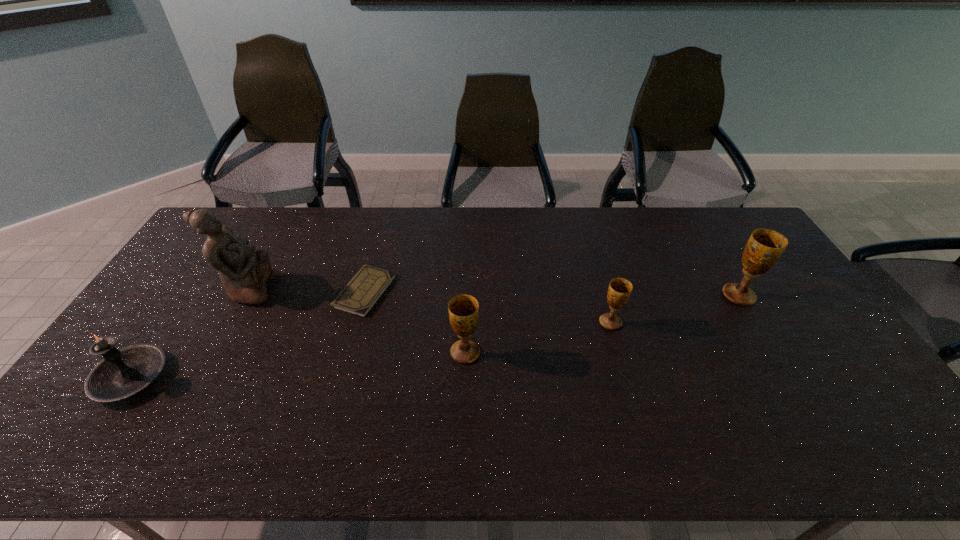
You are a GUI agent. You are given a task and a screenshot of the screen. Output one action in this format:
    pyautogui.click(x=<x>, y=<y>)
    Task: Click on the free space that satisfies the following two spatial constraints: 1. on the front-facing side of the tallest chalice; 2. on the left side of the tallest object
    The height and width of the screenshot is (540, 960).
    Given the screenshot: What is the action you would take?
    pyautogui.click(x=246, y=295)

Locate an element on the screen. free point that satisfies the following two spatial constraints: 1. on the front-facing side of the second object from left to right; 2. on the right side of the leftmost chalice is located at coordinates (214, 353).

Where is `vacant space that satisfies the following two spatial constraints: 1. on the front-facing side of the tallest object; 2. on the right side of the second chalice from right to left`? The height and width of the screenshot is (540, 960). vacant space that satisfies the following two spatial constraints: 1. on the front-facing side of the tallest object; 2. on the right side of the second chalice from right to left is located at coordinates (231, 322).

You are a GUI agent. You are given a task and a screenshot of the screen. Output one action in this format:
    pyautogui.click(x=<x>, y=<y>)
    Task: Click on the free spot that satisfies the following two spatial constraints: 1. on the front-facing side of the second shortest chalice; 2. on the left side of the tallest object
    
    Given the screenshot: What is the action you would take?
    pyautogui.click(x=214, y=353)

At what (x,y) coordinates should I click in order to perform the action: click on vacant space that satisfies the following two spatial constraints: 1. on the back side of the third object from right to left; 2. on the right side of the candle. Please return your answer as a coordinate pair (x, y). Looking at the image, I should click on (148, 353).